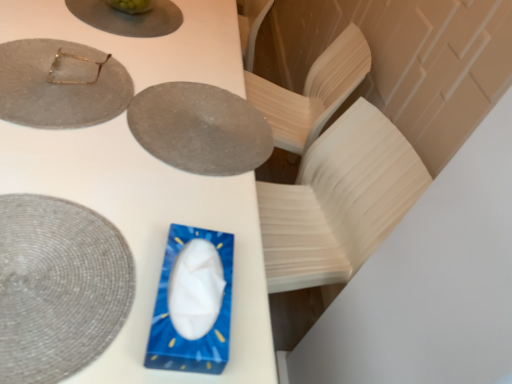
Question: Can you confirm if gold metallic glasses at upper left is taller than matte gray plate at upper center, placed as the third plate when sorted from top to bottom?

Choices:
 (A) no
 (B) yes

Answer: (B)

Question: From a real-world perspective, is gold metallic glasses at upper left located beneath matte gray plate at upper center, the second plate positioned from the bottom?

Choices:
 (A) yes
 (B) no

Answer: (B)

Question: Considering the relative sizes of gold metallic glasses at upper left and matte gray plate at upper center, placed as the third plate when sorted from top to bottom, in the image provided, is gold metallic glasses at upper left smaller than matte gray plate at upper center, placed as the third plate when sorted from top to bottom,?

Choices:
 (A) yes
 (B) no

Answer: (A)

Question: Considering the relative sizes of gold metallic glasses at upper left and matte gray plate at upper center, placed as the third plate when sorted from top to bottom, in the image provided, is gold metallic glasses at upper left thinner than matte gray plate at upper center, placed as the third plate when sorted from top to bottom,?

Choices:
 (A) yes
 (B) no

Answer: (A)

Question: Could you tell me if gold metallic glasses at upper left is facing matte gray plate at upper center, placed as the third plate when sorted from top to bottom?

Choices:
 (A) no
 (B) yes

Answer: (A)

Question: Is gold metallic glasses at upper left positioned in front of matte gray plate at upper center, the second plate positioned from the bottom?

Choices:
 (A) no
 (B) yes

Answer: (A)

Question: Is gold metallic glasses at upper left completely or partially inside matte gray plate at upper center, the 4th plate positioned from the bottom?

Choices:
 (A) yes
 (B) no

Answer: (B)

Question: Is matte gray plate at upper center, the 4th plate positioned from the bottom, behind gold metallic glasses at upper left?

Choices:
 (A) yes
 (B) no

Answer: (A)

Question: Considering the relative sizes of matte gray plate at upper center, positioned as the 1th plate in top-to-bottom order, and gold metallic glasses at upper left in the image provided, is matte gray plate at upper center, positioned as the 1th plate in top-to-bottom order, taller than gold metallic glasses at upper left?

Choices:
 (A) yes
 (B) no

Answer: (B)

Question: From a real-world perspective, does matte gray plate at upper center, the 4th plate positioned from the bottom, stand above gold metallic glasses at upper left?

Choices:
 (A) yes
 (B) no

Answer: (B)

Question: From the image's perspective, does matte gray plate at upper center, the 4th plate positioned from the bottom, appear lower than gold metallic glasses at upper left?

Choices:
 (A) no
 (B) yes

Answer: (A)

Question: Does matte gray plate at upper center, the 4th plate positioned from the bottom, have a larger size compared to gold metallic glasses at upper left?

Choices:
 (A) no
 (B) yes

Answer: (B)

Question: Does blue plastic tissue box at center lie in front of gold metallic glasses at upper left?

Choices:
 (A) no
 (B) yes

Answer: (B)